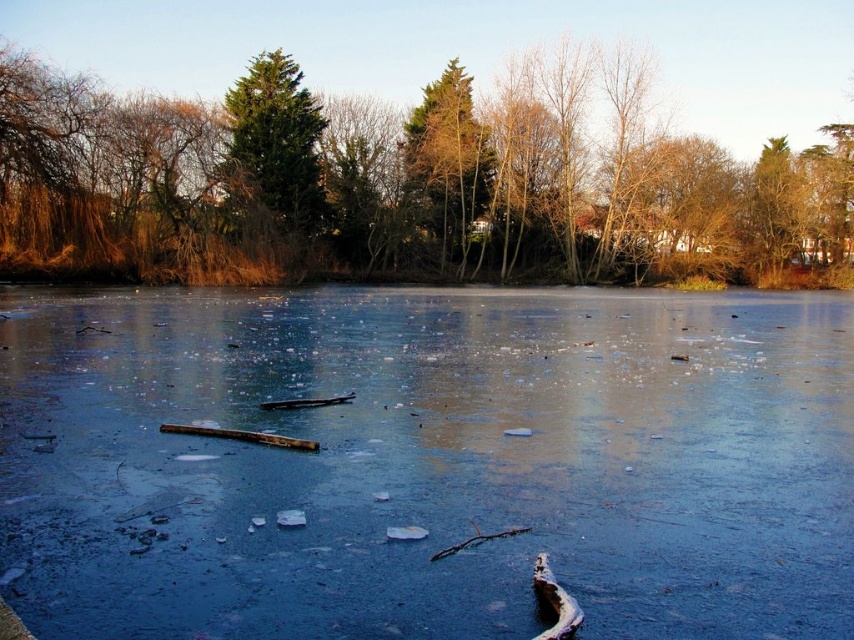
Describe the element at coordinates (401, 184) in the screenshot. The width and height of the screenshot is (854, 640). I see `green textured tree at upper center` at that location.

Between green textured tree at upper center and green textured evergreen tree at upper center, which one appears on the left side from the viewer's perspective?

green textured evergreen tree at upper center is more to the left.

Measure the distance between point (232, 259) and camera.

Point (232, 259) is 45.84 meters from camera.

Where is `green textured tree at upper center`? The image size is (854, 640). green textured tree at upper center is located at coordinates (401, 184).

Does point (32, 346) lie in front of point (483, 168)?

Yes, point (32, 346) is closer to viewer.

Is translucent ice at center in front of green matte tree at center?

Yes, it is in front of green matte tree at center.

Find the location of a particular element. This screenshot has height=640, width=854. translucent ice at center is located at coordinates (428, 464).

Is point (114, 360) less distant than point (299, 97)?

Yes.

The width and height of the screenshot is (854, 640). I want to click on translucent ice at center, so click(428, 464).